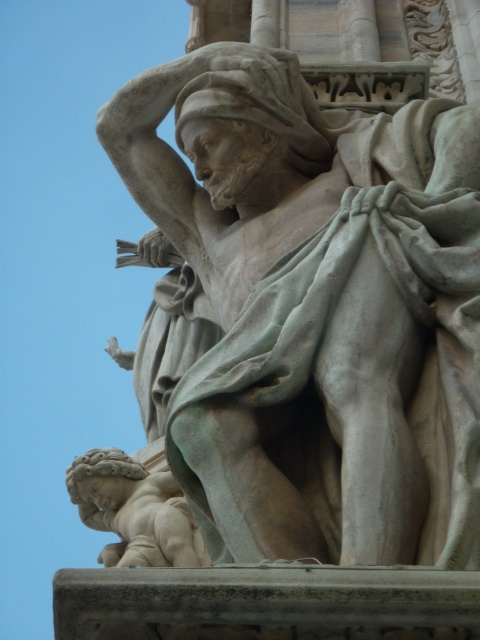
Question: Which point appears farthest from the camera in this image?

Choices:
 (A) (236, 198)
 (B) (95, 465)

Answer: (B)

Question: Among these points, which one is nearest to the camera?

Choices:
 (A) (207, 442)
 (B) (118, 474)

Answer: (A)

Question: Is white marble statue at upper center wider than smooth beige cherub at lower left?

Choices:
 (A) yes
 (B) no

Answer: (A)

Question: Observing the image, what is the correct spatial positioning of white marble statue at upper center in reference to smooth beige cherub at lower left?

Choices:
 (A) below
 (B) above

Answer: (B)

Question: Which of the following is the farthest from the observer?

Choices:
 (A) (165, 493)
 (B) (288, 301)

Answer: (A)

Question: Where is white marble statue at upper center located in relation to smooth beige cherub at lower left in the image?

Choices:
 (A) below
 (B) above

Answer: (B)